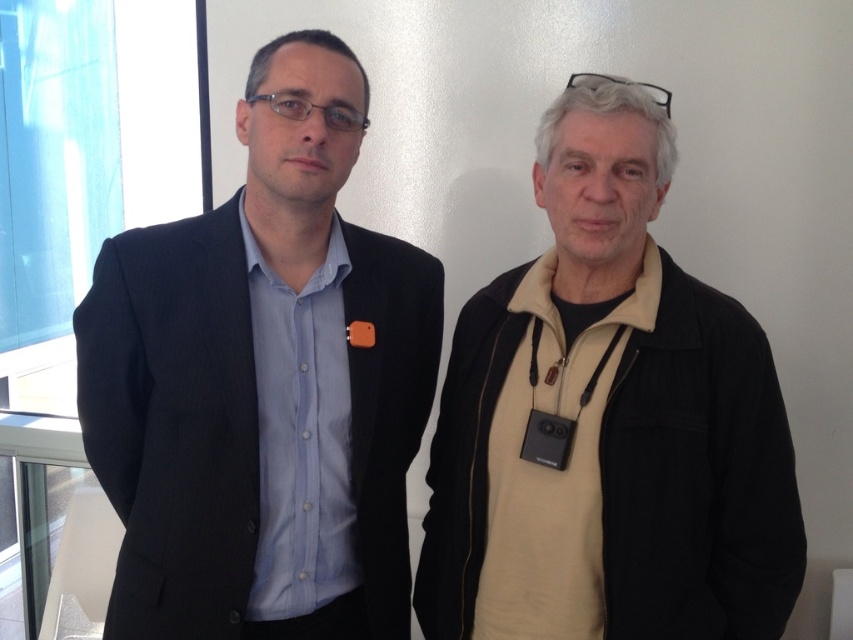
Question: Can you confirm if matte black suit at left is positioned above beige fleece at right?

Choices:
 (A) no
 (B) yes

Answer: (B)

Question: Is matte black suit at left smaller than beige fleece at right?

Choices:
 (A) no
 (B) yes

Answer: (B)

Question: Among these points, which one is nearest to the camera?

Choices:
 (A) (363, 285)
 (B) (587, 340)

Answer: (B)

Question: Which object is closer to the camera taking this photo?

Choices:
 (A) matte black suit at left
 (B) beige fleece at right

Answer: (B)

Question: Is matte black suit at left above beige fleece at right?

Choices:
 (A) no
 (B) yes

Answer: (B)